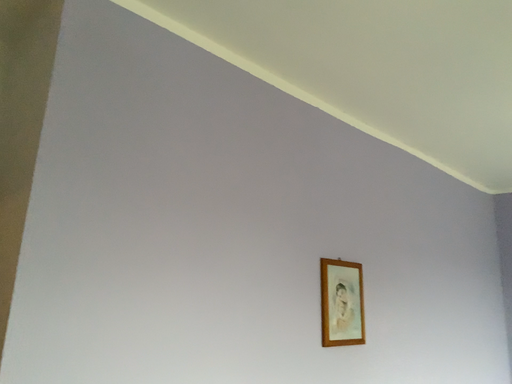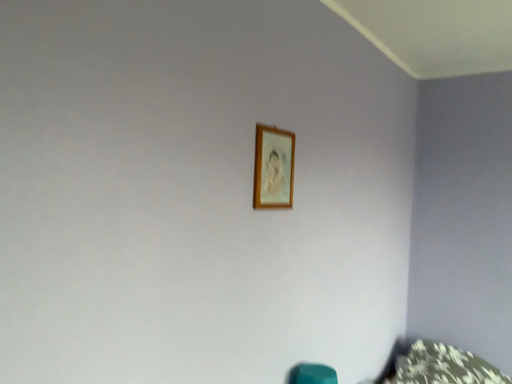
Question: Which way did the camera rotate in the video?

Choices:
 (A) rotated upward
 (B) rotated downward

Answer: (B)